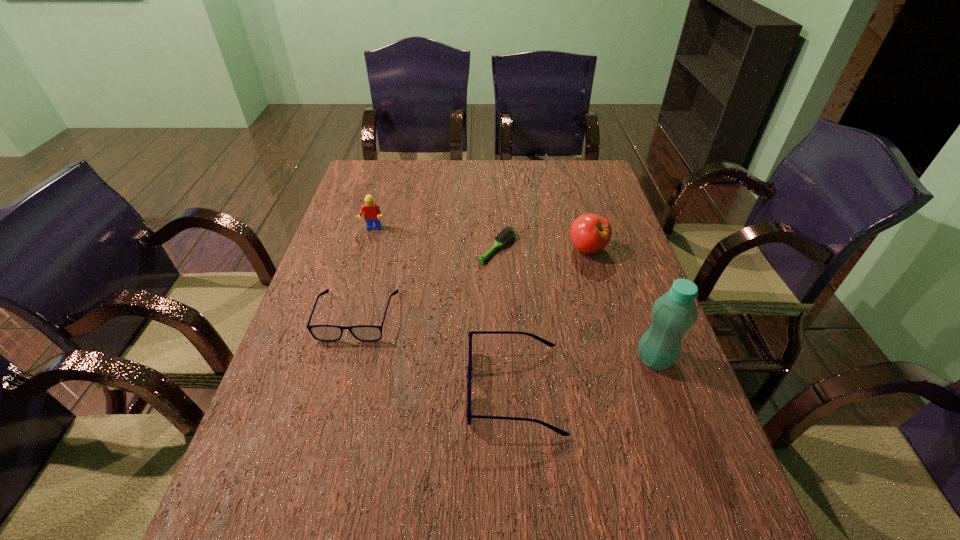
Image resolution: width=960 pixels, height=540 pixels. What are the coordinates of `the fourth farthest object` in the screenshot? It's located at 328,333.

Image resolution: width=960 pixels, height=540 pixels. In order to click on the shorter spectacles in this screenshot , I will do tap(328, 333).

The height and width of the screenshot is (540, 960). Identify the location of the right spectacles. (469, 376).

I want to click on the fourth tallest object, so click(469, 376).

Locate an element on the screen. hairbrush is located at coordinates (506, 234).

The image size is (960, 540). Identify the location of apple. (590, 233).

At what (x,y) coordinates should I click in order to perform the action: click on Lego. Please return your answer as a coordinate pair (x, y). The height and width of the screenshot is (540, 960). Looking at the image, I should click on (372, 213).

Where is `the tallest object`? the tallest object is located at coordinates (674, 313).

Identify the location of vacant point located 0.290m on the front-facing side of the farther spectacles. (317, 463).

Locate an element on the screen. Image resolution: width=960 pixels, height=540 pixels. free space located on the front-facing side of the nearer spectacles is located at coordinates (403, 389).